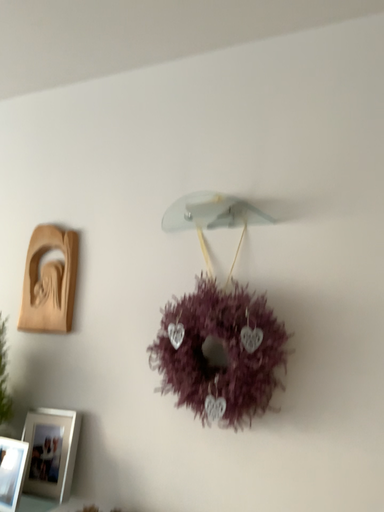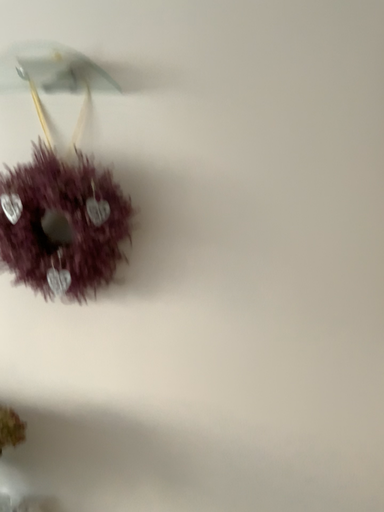
Question: Which way did the camera rotate in the video?

Choices:
 (A) rotated downward
 (B) rotated upward

Answer: (A)